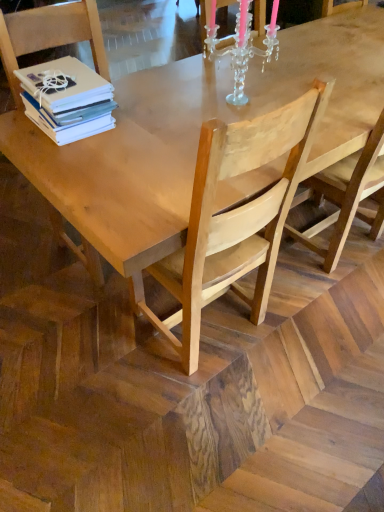
I want to click on blank space to the left of light brown wooden chair at center, the 1th chair positioned from the right, so click(91, 340).